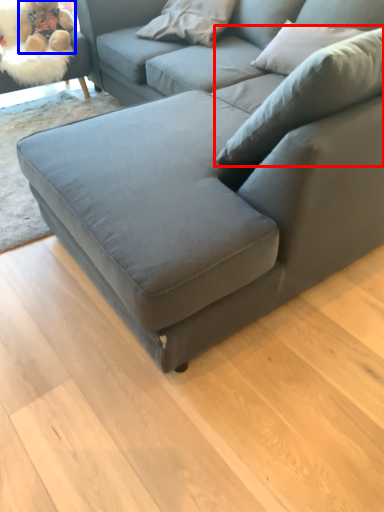
Question: Which object is closer to the camera taking this photo, pillow (highlighted by a red box) or toy (highlighted by a blue box)?

Choices:
 (A) pillow
 (B) toy

Answer: (A)